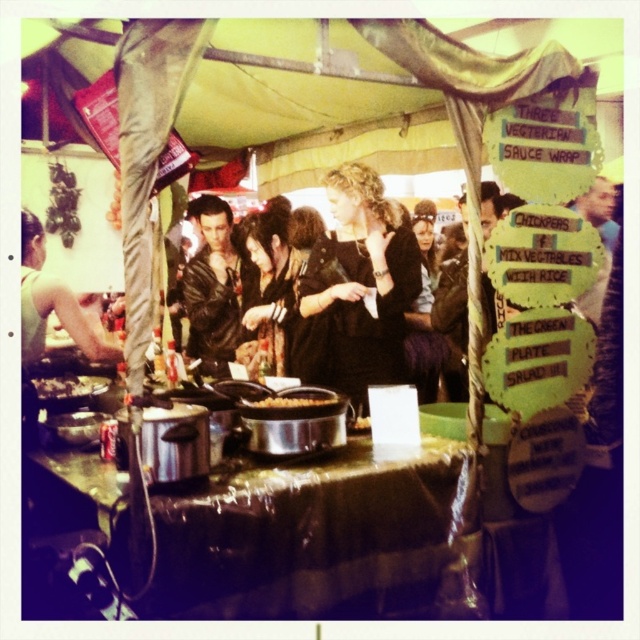
You are a customer at the food stall and want to reach the slightly browned metal pan at center to ask about its contents. However, the leather jacket at center is blocking your view. Can you move the jacket to access the pan?

The slightly browned metal pan at center is behind the leather jacket at center, so you can move the jacket to access the pan.

You are a customer at the food stall and want to pick up the brown matte food at center. However, there is a slightly browned metal pan at center in the way. Can you reach the food without moving the pan?

The brown matte food at center is closer to the viewer than the slightly browned metal pan at center, so you can reach the brown matte food at center without moving the pan since it is in front of the pan.

You are a customer at the food stall and want to place your leather jacket at center on top of the slightly browned metal pan at center. Will the jacket fit entirely on the pan?

The leather jacket at center is wider than the slightly browned metal pan at center, so the jacket will not fit entirely on the pan.